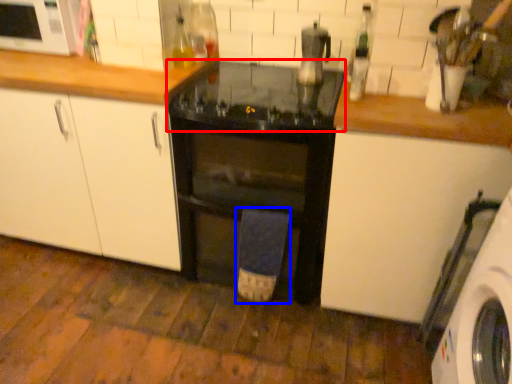
Question: Which object appears closest to the camera in this image, gas stove (highlighted by a red box) or bath towel (highlighted by a blue box)?

Choices:
 (A) gas stove
 (B) bath towel

Answer: (A)